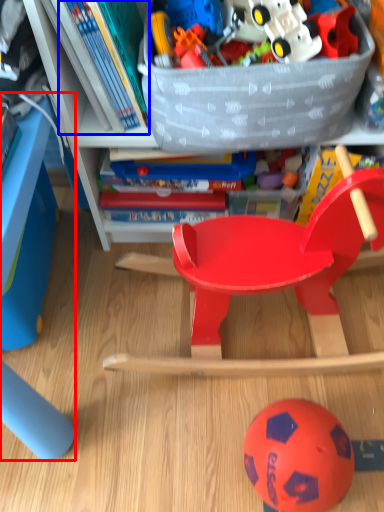
Question: Among these objects, which one is farthest to the camera, table (highlighted by a red box) or book (highlighted by a blue box)?

Choices:
 (A) table
 (B) book

Answer: (A)